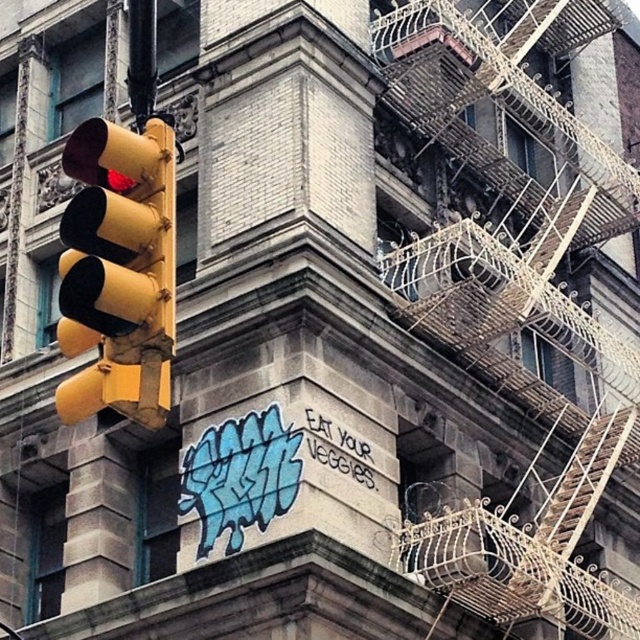
You are a delivery person trying to navigate through the street. You see the rustic metal fire escape at right and the yellow matte traffic light at left. Which object is located to the right of the other?

The rustic metal fire escape at right is positioned on the right side of yellow matte traffic light at left.

You are standing at the base of the building and want to take a photo of the rustic metal fire escape at right. If your camera can focus on objects up to 150 feet away, will you need to move closer to get a clear shot?

The rustic metal fire escape at right is 165.62 feet from the camera, which is beyond the camera focus range of 150 feet. You need to move closer to get a clear shot.